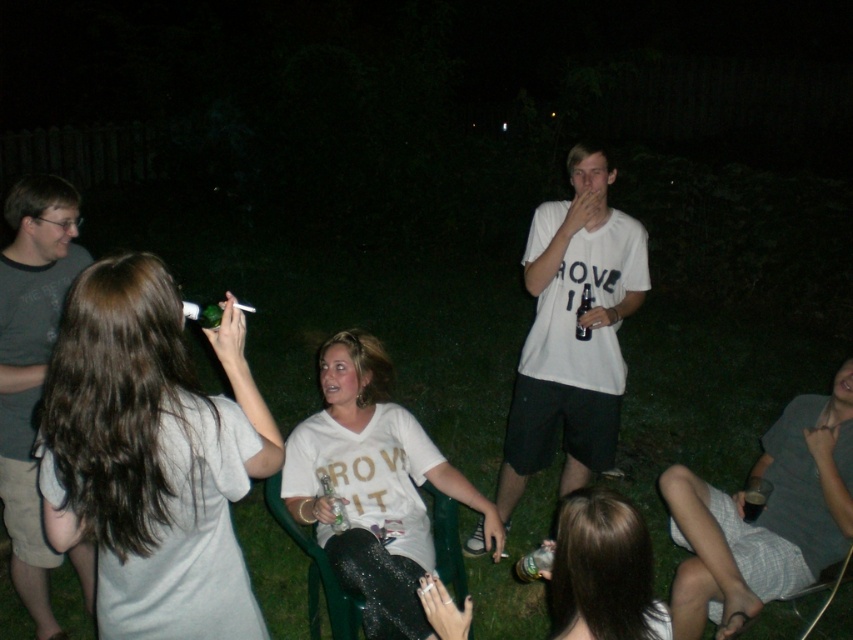
You are at a social gathering and want to introduce yourself to both the matte gray shirt at upper left and the matte white shirt at lower center. Which person should you approach first if you start from the left side of the image?

You should approach the matte gray shirt at upper left first because it is positioned to the left of the matte white shirt at lower center.